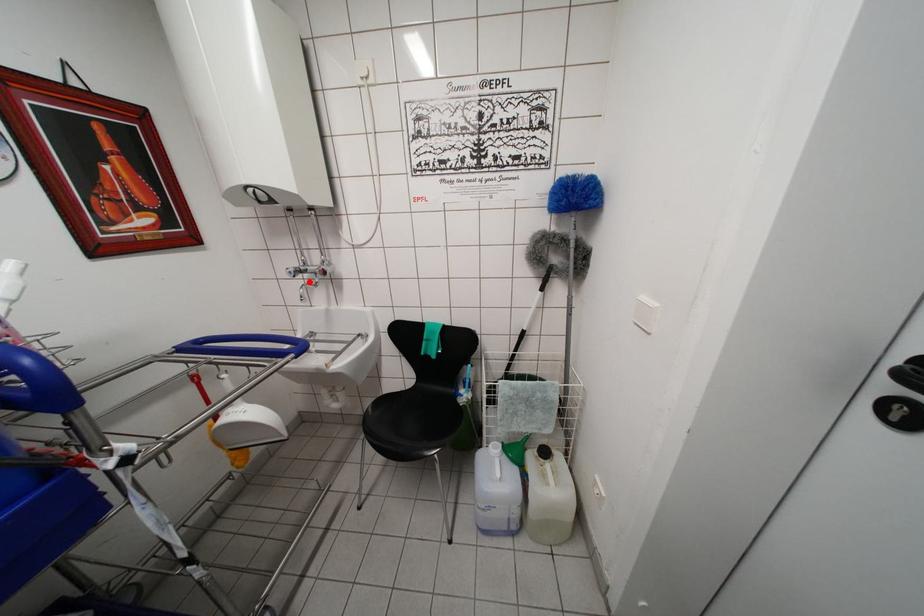
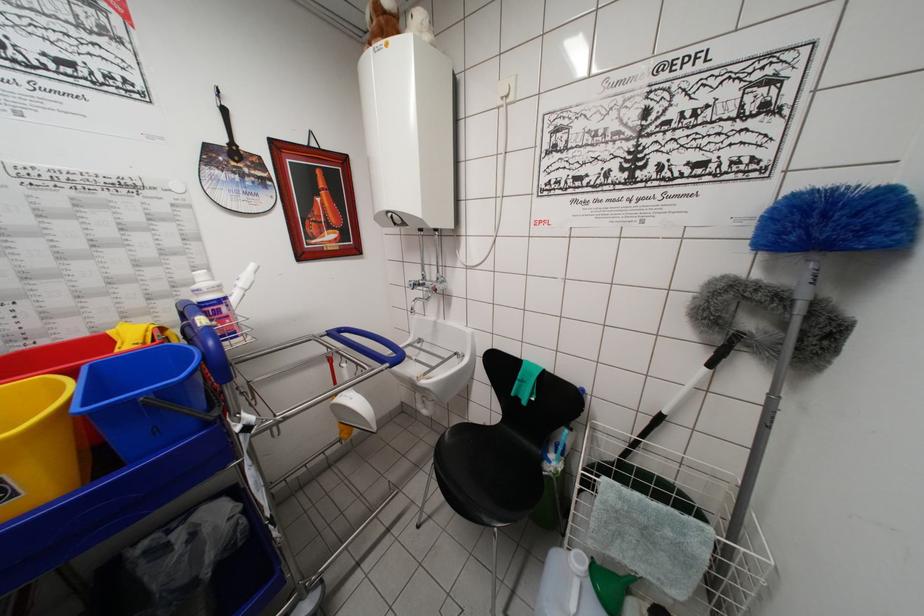
The point at the highlighted location is marked in the first image. Where is the corresponding point in the second image?

(428, 294)